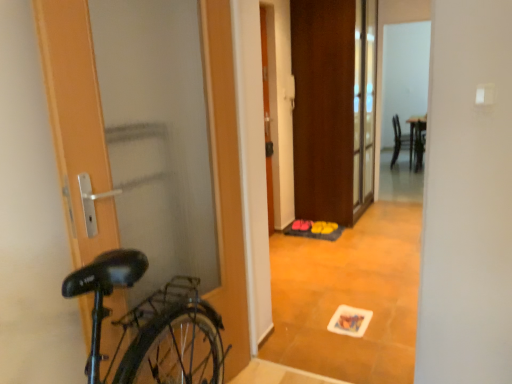
Question: Does wooden door at left, the 1th door when ordered from left to right, have a greater width compared to wooden floor mat at center?

Choices:
 (A) yes
 (B) no

Answer: (A)

Question: Would you say wooden door at left, the third door when ordered from back to front, is outside wooden floor mat at center?

Choices:
 (A) no
 (B) yes

Answer: (B)

Question: Can you confirm if wooden door at left, the 1th door when ordered from left to right, is shorter than wooden floor mat at center?

Choices:
 (A) no
 (B) yes

Answer: (B)

Question: Is wooden door at left, arranged as the third door when viewed from the right, looking in the opposite direction of wooden floor mat at center?

Choices:
 (A) yes
 (B) no

Answer: (B)

Question: From a real-world perspective, is wooden door at left, the 1th door when ordered from left to right, below wooden floor mat at center?

Choices:
 (A) yes
 (B) no

Answer: (A)

Question: Are wooden door at left, marked as the first door in a front-to-back arrangement, and wooden floor mat at center making contact?

Choices:
 (A) no
 (B) yes

Answer: (A)

Question: Is yellow rubber doormat at center closer to camera compared to matte black chair at upper right?

Choices:
 (A) no
 (B) yes

Answer: (B)

Question: Is yellow rubber doormat at center oriented towards matte black chair at upper right?

Choices:
 (A) no
 (B) yes

Answer: (A)

Question: Is yellow rubber doormat at center directly adjacent to matte black chair at upper right?

Choices:
 (A) no
 (B) yes

Answer: (A)

Question: Considering the relative sizes of yellow rubber doormat at center and matte black chair at upper right in the image provided, is yellow rubber doormat at center taller than matte black chair at upper right?

Choices:
 (A) yes
 (B) no

Answer: (B)

Question: Does yellow rubber doormat at center have a greater width compared to matte black chair at upper right?

Choices:
 (A) yes
 (B) no

Answer: (A)

Question: Is yellow rubber doormat at center at the left side of matte black chair at upper right?

Choices:
 (A) yes
 (B) no

Answer: (A)

Question: Considering the relative positions of brown matte door at center, arranged as the third door when viewed from the front, and yellow rubber doormat at center in the image provided, is brown matte door at center, arranged as the third door when viewed from the front, to the left of yellow rubber doormat at center from the viewer's perspective?

Choices:
 (A) no
 (B) yes

Answer: (A)